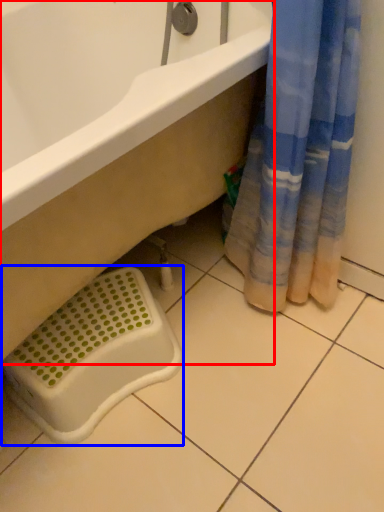
Question: Which point is closer to the camera, bathtub (highlighted by a red box) or laundry basket (highlighted by a blue box)?

Choices:
 (A) bathtub
 (B) laundry basket

Answer: (A)